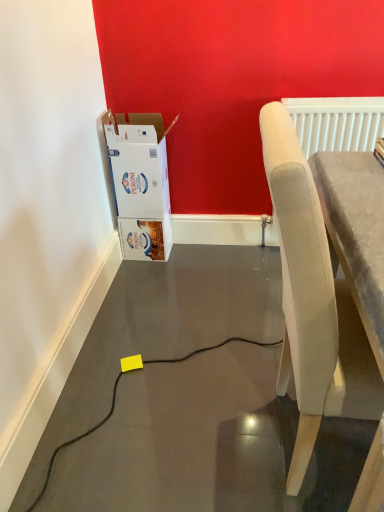
Question: In terms of height, does white textured radiator at upper right look taller or shorter compared to light gray fabric chair at right?

Choices:
 (A) tall
 (B) short

Answer: (B)

Question: From a real-world perspective, is white textured radiator at upper right above or below light gray fabric chair at right?

Choices:
 (A) above
 (B) below

Answer: (A)

Question: Based on their relative distances, which object is nearer to the light gray fabric chair at right?

Choices:
 (A) white textured radiator at upper right
 (B) white cardboard box at left

Answer: (A)

Question: Which is nearer to the light gray fabric chair at right?

Choices:
 (A) white cardboard box at left
 (B) white textured radiator at upper right

Answer: (B)